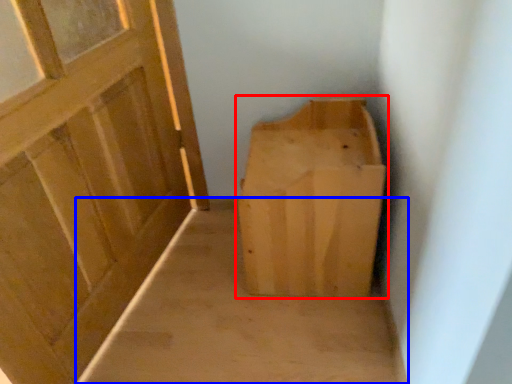
Question: Which object is closer to the camera taking this photo, furniture (highlighted by a red box) or plain (highlighted by a blue box)?

Choices:
 (A) furniture
 (B) plain

Answer: (A)